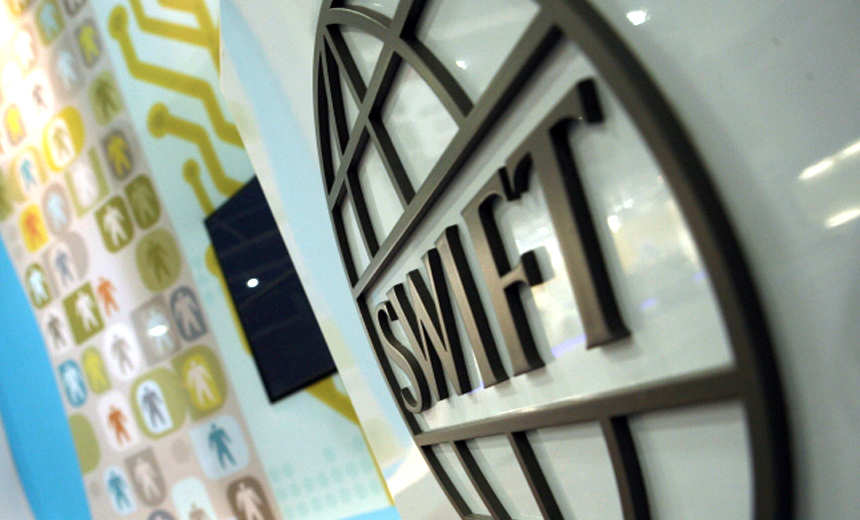
Image resolution: width=860 pixels, height=520 pixels. Identify the location of door lock. (250, 280).